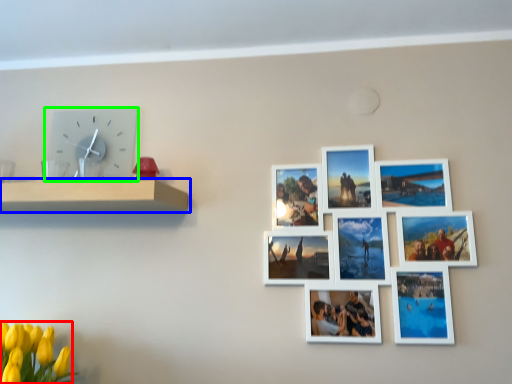
Question: Which is nearer to the flower (highlighted by a red box)? shelf (highlighted by a blue box) or wall clock (highlighted by a green box).

Choices:
 (A) shelf
 (B) wall clock

Answer: (A)